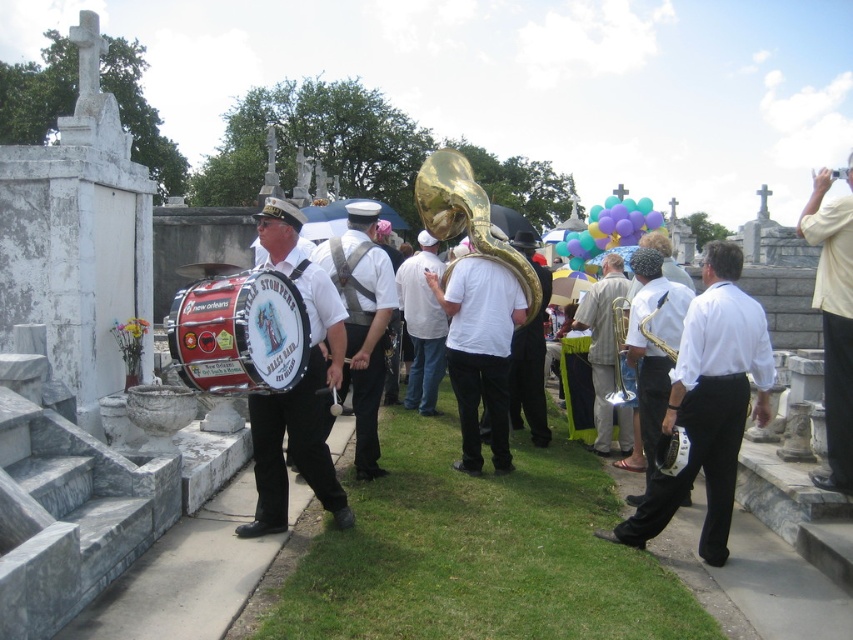
The image size is (853, 640). What are the coordinates of `red drum at center` in the screenshot? It's located at (239, 332).

Identify the location of red drum at center. Image resolution: width=853 pixels, height=640 pixels. (239, 332).

Can you confirm if white matte tuba at center is positioned to the left of white matte shirt at center?

In fact, white matte tuba at center is to the right of white matte shirt at center.

Is point (459, 419) positioned before point (418, 236)?

Yes, it is in front of point (418, 236).

This screenshot has width=853, height=640. Describe the element at coordinates (480, 352) in the screenshot. I see `white matte tuba at center` at that location.

Identify the location of white matte tuba at center. (480, 352).

Does red drum at center appear on the left side of gold metallic tuba at center?

Indeed, red drum at center is positioned on the left side of gold metallic tuba at center.

Does red drum at center lie behind gold metallic tuba at center?

No, it is not.

Image resolution: width=853 pixels, height=640 pixels. In order to click on red drum at center in this screenshot , I will do `click(239, 332)`.